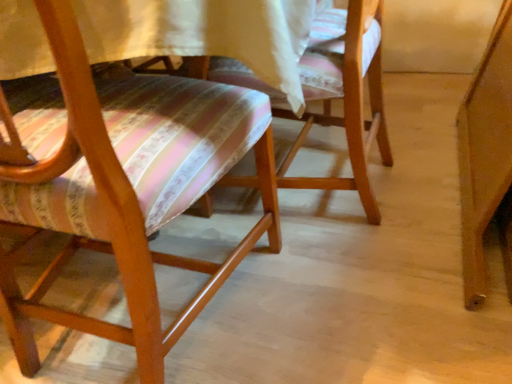
Locate an element on the screen. The width and height of the screenshot is (512, 384). wooden chair with striped cushion at left, the 1th chair positioned from the left is located at coordinates (120, 183).

The image size is (512, 384). Describe the element at coordinates (120, 183) in the screenshot. I see `wooden chair with striped cushion at left, the 2th chair in the right-to-left sequence` at that location.

This screenshot has height=384, width=512. Describe the element at coordinates (345, 94) in the screenshot. I see `wooden chair at center, acting as the 1th chair starting from the right` at that location.

Where is `wooden chair at center, the second chair viewed from the left`? The height and width of the screenshot is (384, 512). wooden chair at center, the second chair viewed from the left is located at coordinates (345, 94).

Where is `wooden chair with striped cushion at left, the 2th chair in the right-to-left sequence`? This screenshot has height=384, width=512. wooden chair with striped cushion at left, the 2th chair in the right-to-left sequence is located at coordinates (120, 183).

Between wooden chair with striped cushion at left, the 1th chair positioned from the left, and wooden chair at center, acting as the 1th chair starting from the right, which one appears on the left side from the viewer's perspective?

wooden chair with striped cushion at left, the 1th chair positioned from the left, is more to the left.

Which is behind, wooden chair with striped cushion at left, the 2th chair in the right-to-left sequence, or wooden chair at center, acting as the 1th chair starting from the right?

wooden chair at center, acting as the 1th chair starting from the right.

Is point (2, 109) positioned before point (281, 97)?

That is True.

From the image's perspective, relative to wooden chair at center, the second chair viewed from the left, is wooden chair with striped cushion at left, the 1th chair positioned from the left, above or below?

Based on their image positions, wooden chair with striped cushion at left, the 1th chair positioned from the left, is located beneath wooden chair at center, the second chair viewed from the left.

From a real-world perspective, does wooden chair with striped cushion at left, the 2th chair in the right-to-left sequence, sit lower than wooden chair at center, the second chair viewed from the left?

No, from a real-world perspective, wooden chair with striped cushion at left, the 2th chair in the right-to-left sequence, is not under wooden chair at center, the second chair viewed from the left.

Considering the relative sizes of wooden chair with striped cushion at left, the 1th chair positioned from the left, and wooden chair at center, the second chair viewed from the left, in the image provided, is wooden chair with striped cushion at left, the 1th chair positioned from the left, wider than wooden chair at center, the second chair viewed from the left,?

Yes.

Consider the image. Does wooden chair with striped cushion at left, the 2th chair in the right-to-left sequence, have a greater height compared to wooden chair at center, the second chair viewed from the left?

Yes, wooden chair with striped cushion at left, the 2th chair in the right-to-left sequence, is taller than wooden chair at center, the second chair viewed from the left.

Is wooden chair with striped cushion at left, the 2th chair in the right-to-left sequence, bigger or smaller than wooden chair at center, the second chair viewed from the left?

In the image, wooden chair with striped cushion at left, the 2th chair in the right-to-left sequence, appears to be larger than wooden chair at center, the second chair viewed from the left.

Would you say wooden chair with striped cushion at left, the 2th chair in the right-to-left sequence, is outside wooden chair at center, acting as the 1th chair starting from the right?

That's correct, wooden chair with striped cushion at left, the 2th chair in the right-to-left sequence, is outside of wooden chair at center, acting as the 1th chair starting from the right.

Are wooden chair with striped cushion at left, the 2th chair in the right-to-left sequence, and wooden chair at center, acting as the 1th chair starting from the right, making contact?

No, wooden chair with striped cushion at left, the 2th chair in the right-to-left sequence, is not beside wooden chair at center, acting as the 1th chair starting from the right.

Is wooden chair with striped cushion at left, the 2th chair in the right-to-left sequence, oriented away from wooden chair at center, the second chair viewed from the left?

wooden chair with striped cushion at left, the 2th chair in the right-to-left sequence, is not turned away from wooden chair at center, the second chair viewed from the left.

How much distance is there between wooden chair with striped cushion at left, the 2th chair in the right-to-left sequence, and wooden chair at center, acting as the 1th chair starting from the right?

They are 12.58 inches apart.

Locate an element on the screen. This screenshot has height=384, width=512. chair on the right of the wooden chair with striped cushion at left, the 1th chair positioned from the left is located at coordinates (345, 94).

Which object is positioned more to the right, wooden chair at center, acting as the 1th chair starting from the right, or wooden chair with striped cushion at left, the 2th chair in the right-to-left sequence?

Positioned to the right is wooden chair at center, acting as the 1th chair starting from the right.

Considering the positions of objects wooden chair at center, the second chair viewed from the left, and wooden chair with striped cushion at left, the 2th chair in the right-to-left sequence, in the image provided, who is in front, wooden chair at center, the second chair viewed from the left, or wooden chair with striped cushion at left, the 2th chair in the right-to-left sequence,?

wooden chair with striped cushion at left, the 2th chair in the right-to-left sequence, is closer to the camera.

Is point (375, 223) less distant than point (177, 202)?

No.

From the image's perspective, is wooden chair at center, the second chair viewed from the left, on top of wooden chair with striped cushion at left, the 1th chair positioned from the left?

Indeed, from the image's perspective, wooden chair at center, the second chair viewed from the left, is shown above wooden chair with striped cushion at left, the 1th chair positioned from the left.

From a real-world perspective, which object rests below the other?

In real-world perspective, wooden chair at center, acting as the 1th chair starting from the right, is lower.

Can you confirm if wooden chair at center, the second chair viewed from the left, is thinner than wooden chair with striped cushion at left, the 2th chair in the right-to-left sequence?

Yes, wooden chair at center, the second chair viewed from the left, is thinner than wooden chair with striped cushion at left, the 2th chair in the right-to-left sequence.

Does wooden chair at center, the second chair viewed from the left, have a lesser height compared to wooden chair with striped cushion at left, the 1th chair positioned from the left?

Correct, wooden chair at center, the second chair viewed from the left, is not as tall as wooden chair with striped cushion at left, the 1th chair positioned from the left.

Which of these two, wooden chair at center, the second chair viewed from the left, or wooden chair with striped cushion at left, the 1th chair positioned from the left, is smaller?

wooden chair at center, the second chair viewed from the left, is smaller.

Is wooden chair with striped cushion at left, the 1th chair positioned from the left, located within wooden chair at center, the second chair viewed from the left?

No, wooden chair with striped cushion at left, the 1th chair positioned from the left, is not a part of wooden chair at center, the second chair viewed from the left.

Would you consider wooden chair at center, acting as the 1th chair starting from the right, to be distant from wooden chair with striped cushion at left, the 1th chair positioned from the left?

No.

Is wooden chair with striped cushion at left, the 2th chair in the right-to-left sequence, at the back of wooden chair at center, the second chair viewed from the left?

wooden chair at center, the second chair viewed from the left, is not turned away from wooden chair with striped cushion at left, the 2th chair in the right-to-left sequence.

From the picture: Can you tell me how much wooden chair at center, the second chair viewed from the left, and wooden chair with striped cushion at left, the 1th chair positioned from the left, differ in facing direction?

The angular difference between wooden chair at center, the second chair viewed from the left, and wooden chair with striped cushion at left, the 1th chair positioned from the left, is 88.6 degrees.

Identify the location of chair above the wooden chair with striped cushion at left, the 2th chair in the right-to-left sequence (from the image's perspective). Image resolution: width=512 pixels, height=384 pixels. (345, 94).

The height and width of the screenshot is (384, 512). I want to click on chair in front of the wooden chair at center, the second chair viewed from the left, so click(x=120, y=183).

Find the location of a particular element. The width and height of the screenshot is (512, 384). chair that appears above the wooden chair with striped cushion at left, the 2th chair in the right-to-left sequence (from the image's perspective) is located at coordinates (345, 94).